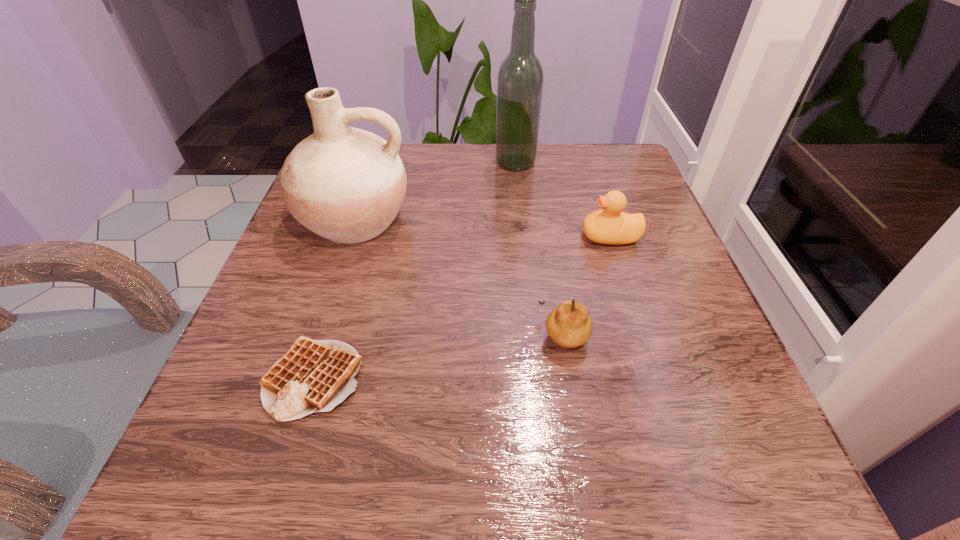
Identify the location of blank area at the near edge. (323, 463).

Identify the location of blank space at the left edge. The height and width of the screenshot is (540, 960). (337, 274).

This screenshot has width=960, height=540. In the image, there is a desktop. In order to click on vacant space at the right edge in this screenshot , I will do `click(672, 235)`.

This screenshot has height=540, width=960. In the image, there is a desktop. In order to click on free space at the far right corner in this screenshot , I will do `click(600, 168)`.

This screenshot has width=960, height=540. Find the location of `free space at the near right corner`. free space at the near right corner is located at coordinates (735, 499).

Where is `empty space between the pear and the duck`? This screenshot has width=960, height=540. empty space between the pear and the duck is located at coordinates (587, 285).

Locate an element on the screen. This screenshot has width=960, height=540. empty location between the duck and the pottery is located at coordinates (482, 228).

At what (x,y) coordinates should I click in order to perform the action: click on vacant space that is in between the pottery and the tallest object. Please return your answer as a coordinate pair (x, y). Looking at the image, I should click on (435, 191).

Where is `empty space between the pear and the duck`? This screenshot has height=540, width=960. empty space between the pear and the duck is located at coordinates (587, 285).

What are the coordinates of `free point between the farthest object and the pear` in the screenshot? It's located at (540, 248).